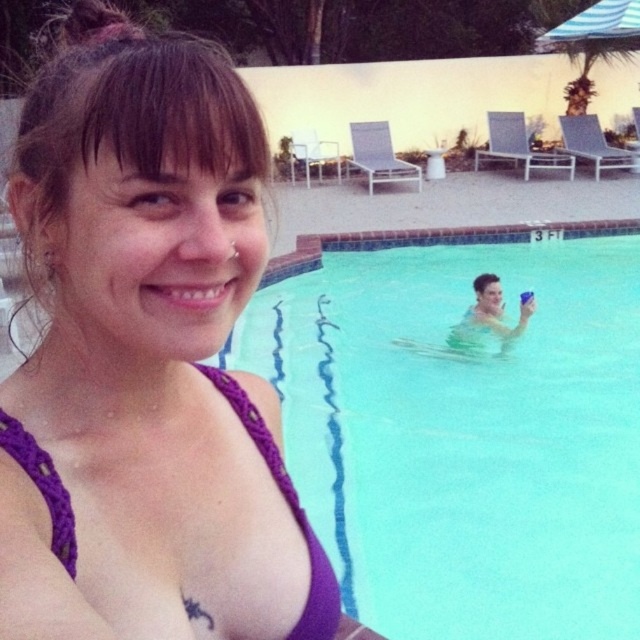
Question: Can you confirm if purple fabric bikini top at upper left is positioned above clear blue water at center?

Choices:
 (A) no
 (B) yes

Answer: (A)

Question: Estimate the real-world distances between objects in this image. Which object is closer to the purple fabric bikini top at upper left?

Choices:
 (A) purple macrame bikini top at center
 (B) clear blue water at center

Answer: (A)

Question: Observing the image, what is the correct spatial positioning of clear blue water at center in reference to purple macrame bikini top at center?

Choices:
 (A) left
 (B) right

Answer: (B)

Question: Which object appears closest to the camera in this image?

Choices:
 (A) clear blue water at center
 (B) purple macrame bikini top at center

Answer: (B)

Question: Among these points, which one is farthest from the camera?

Choices:
 (A) (29, 179)
 (B) (324, 611)
 (C) (294, 442)

Answer: (C)

Question: In this image, where is purple fabric bikini top at upper left located relative to purple macrame bikini top at center?

Choices:
 (A) right
 (B) left

Answer: (B)